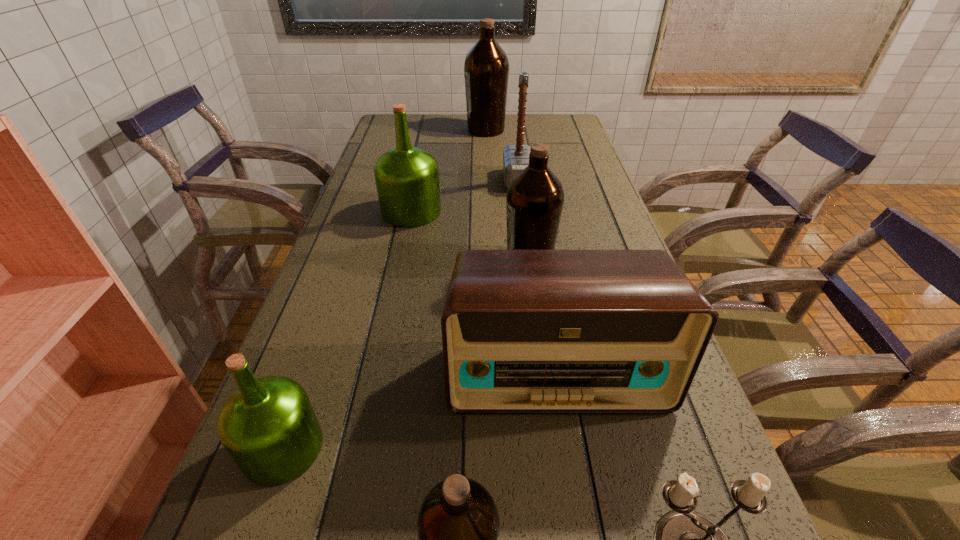
Locate an element on the screen. This screenshot has height=540, width=960. blank region between the second farthest object and the sixth nearest object is located at coordinates (465, 196).

Identify the location of free space between the smaller green olive oil and the third farthest olive oil. (406, 355).

Find the location of a particular element. The width and height of the screenshot is (960, 540). free spot between the second farthest object and the smaller green olive oil is located at coordinates (400, 314).

Locate an element on the screen. The width and height of the screenshot is (960, 540). the second closest object to the second nearest olive oil is located at coordinates (523, 331).

The image size is (960, 540). Find the location of `object that stands as the second closest to the radio receiver`. object that stands as the second closest to the radio receiver is located at coordinates (458, 524).

The image size is (960, 540). What are the coordinates of `the second closest olive oil to the smaller green olive oil` in the screenshot? It's located at (535, 197).

Locate which olive oil ranks second in proximity to the nearest brown olive oil. Please provide its 2D coordinates. Your answer should be formatted as a tuple, i.e. [(x, y)], where the tuple contains the x and y coordinates of a point satisfying the conditions above.

[(535, 197)]

The height and width of the screenshot is (540, 960). What are the coordinates of `brown olive oil that is the closest to the third farthest object` in the screenshot? It's located at (535, 197).

Locate which brown olive oil ranks third in proximity to the third farthest object. Please provide its 2D coordinates. Your answer should be formatted as a tuple, i.e. [(x, y)], where the tuple contains the x and y coordinates of a point satisfying the conditions above.

[(458, 524)]

Locate an element on the screen. The height and width of the screenshot is (540, 960). free region that satisfies the following two spatial constraints: 1. on the striking surface of the seventh nearest object; 2. on the front side of the nearer green olive oil is located at coordinates (553, 448).